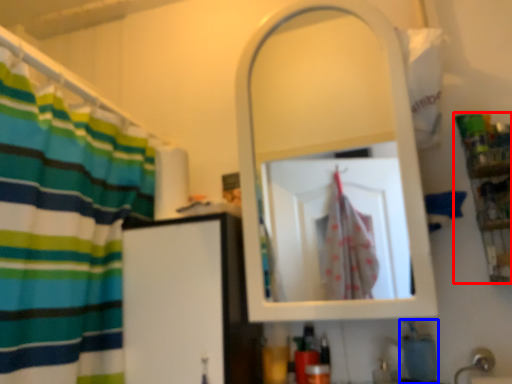
Question: Which of the following is the closest to the observer, shelf (highlighted by a red box) or soap (highlighted by a blue box)?

Choices:
 (A) shelf
 (B) soap

Answer: (A)